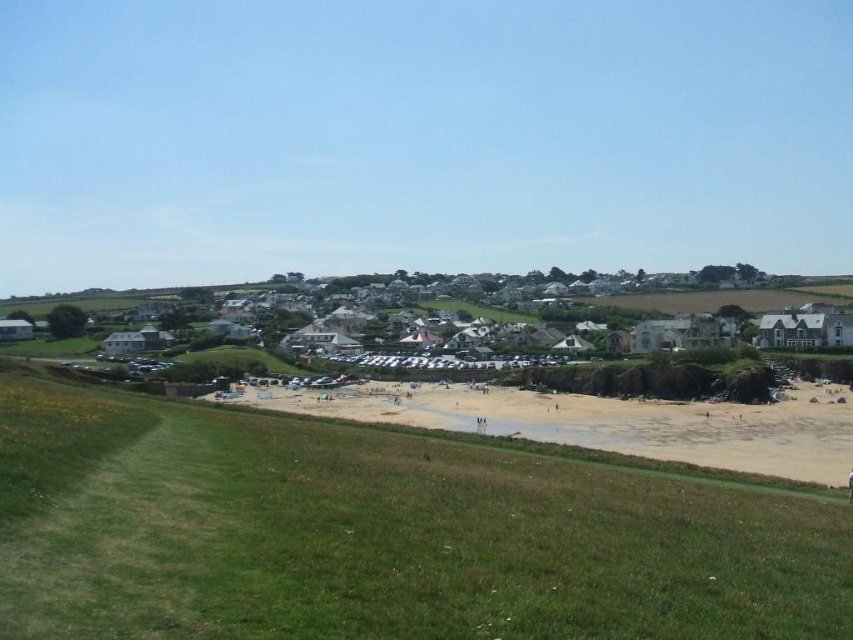
In the scene shown: You are standing at the origin point in the image. Which direction should you move to reach the green grassy field at lower center?

The green grassy field at lower center is located at coordinates 0.836 on the x axis and 0.450 on the y axis. Since you are at the origin point, you should move towards the right and slightly upwards to reach it.

You are a photographer standing at the top of the grassy hill. You want to capture a photo of the green grassy field at lower center and the light brown sand at lower center. Which object will appear closer to the bottom of your camera frame?

The green grassy field at lower center will appear closer to the bottom of the camera frame because it is taller than the light brown sand at lower center.

You are planning to set up a large picnic blanket in the image. The blanket is 3 meters wide. You see the green grassy field at lower center and the light brown sand at lower center. Which area can accommodate the blanket without folding it?

The light brown sand at lower center can accommodate the blanket without folding it because its width is greater than the green grassy field at lower center, which has a smaller width.